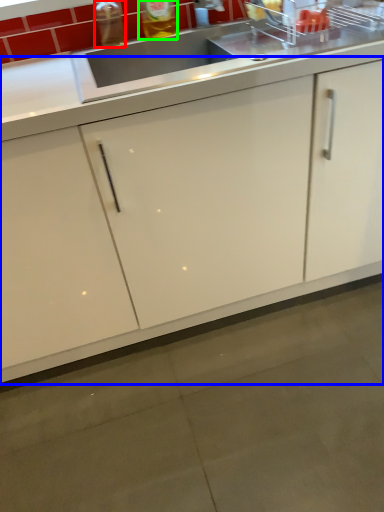
Question: Estimate the real-world distances between objects in this image. Which object is closer to bottle (highlighted by a red box), cabinetry (highlighted by a blue box) or beverage (highlighted by a green box)?

Choices:
 (A) cabinetry
 (B) beverage

Answer: (B)